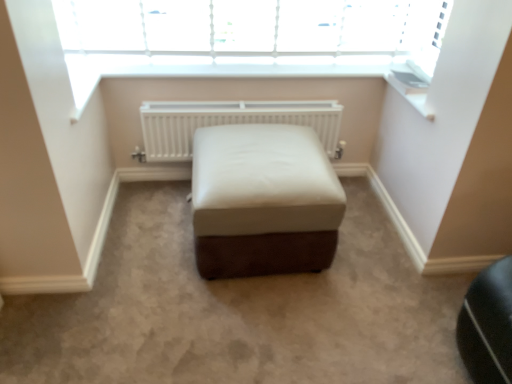
Question: Is white plastic window sill at upper right situated inside white leather ottoman at center or outside?

Choices:
 (A) outside
 (B) inside

Answer: (A)

Question: From their relative heights in the image, would you say white plastic window sill at upper right is taller or shorter than white leather ottoman at center?

Choices:
 (A) short
 (B) tall

Answer: (A)

Question: Which of these objects is positioned farthest from the white matte radiator at center?

Choices:
 (A) white leather ottoman at center
 (B) white plastic window sill at upper right

Answer: (B)

Question: Which is farther from the white matte radiator at center?

Choices:
 (A) white leather ottoman at center
 (B) white plastic window sill at upper right

Answer: (B)